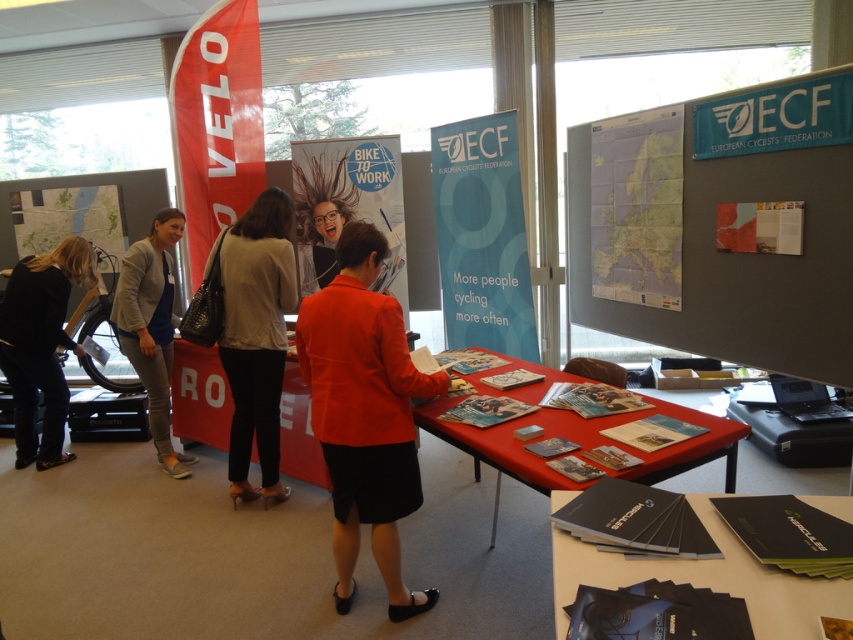
You are a visitor at the event and want to pick up a brochure from the red fabric table at center. However, there is a shiny metallic poster at center blocking your path. Can you walk around it to reach the table?

The red fabric table at center and shiny metallic poster at center are 5.72 feet apart. Since the distance between them is sufficient, you can walk around the shiny metallic poster at center to reach the red fabric table at center.

You are a visitor at the conference and want to approach the red fabric table at center to pick up brochures. However, there is a group of people standing around the shiny metallic poster at center. Based on their positions, which object would you need to walk around first to reach the table?

The red fabric table at center is positioned on the right side of the shiny metallic poster at center. To reach the table, you would first need to navigate around the group near the shiny metallic poster at center since it is located between you and the table.